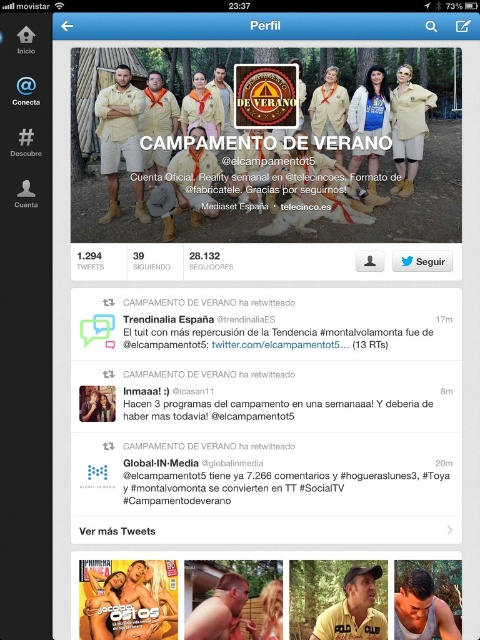
You are a drone operator trying to capture a closeup of the point located at coordinates point (164, 588). The drone is currently 5 meters away from the point. Should you move the drone closer or farther away?

The distance of point (164, 588) from camera is 4.98 meters. Since the drone is currently at 5 meters away, which is slightly farther than the desired distance, you should move the drone closer by 0.02 meters to reach the exact point.

You are a contestant in the Summer Camp reality show and need to locate the leader of your team. The leader is wearing a beige cotton shirt at upper left and is standing in front of the matte khaki uniform at center. Based on the profile picture, can you determine if the leader is closer to the camera compared to the other team member?

The beige cotton shirt at upper left is further to the viewer than matte khaki uniform at center, so yes, the leader is closer to the camera than the other team member wearing the matte khaki uniform at center.

Based on the Twitter profile image for Campamento de Verano, which object is taller between the matte beige shirt at center and the wooden fence at center?

The matte beige shirt at center is much taller than the wooden fence at center according to the description.